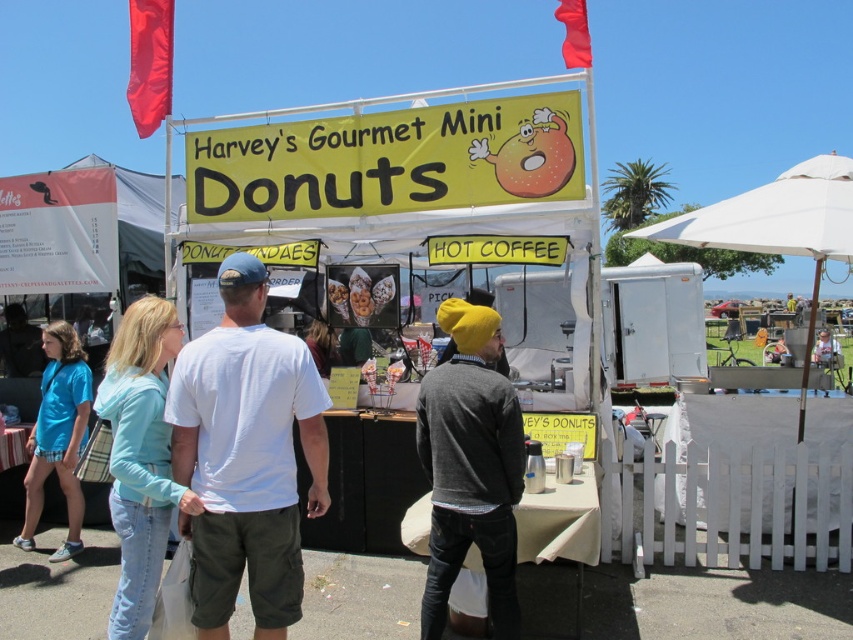
Can you confirm if white metallic food truck at center is shorter than white fabric canopy at upper right?

Correct, white metallic food truck at center is not as tall as white fabric canopy at upper right.

Who is higher up, white metallic food truck at center or white fabric canopy at upper right?

white fabric canopy at upper right

The height and width of the screenshot is (640, 853). Identify the location of white metallic food truck at center. (653, 323).

From the picture: Does white fabric canopy at upper right appear on the right side of blue cotton shirt at left?

Indeed, white fabric canopy at upper right is positioned on the right side of blue cotton shirt at left.

Does white fabric canopy at upper right appear over blue cotton shirt at left?

Indeed, white fabric canopy at upper right is positioned over blue cotton shirt at left.

Between point (819, 268) and point (28, 532), which one is positioned in front?

Positioned in front is point (28, 532).

Find the location of `white fabric canopy at upper right`. white fabric canopy at upper right is located at coordinates (775, 216).

Which is below, knit yellow beanie at center or white metallic food truck at center?

Positioned lower is white metallic food truck at center.

Does point (439, 429) come behind point (572, 276)?

No, it is not.

Does point (469, 413) lie behind point (544, 369)?

That is False.

Locate an element on the screen. Image resolution: width=853 pixels, height=640 pixels. knit yellow beanie at center is located at coordinates (469, 467).